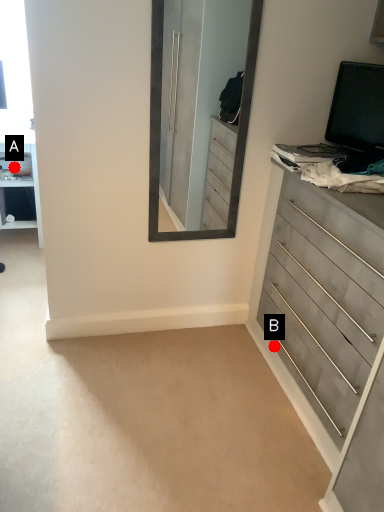
Question: Two points are circled on the image, labeled by A and B beside each circle. Which point is closer to the camera?

Choices:
 (A) A is closer
 (B) B is closer

Answer: (B)